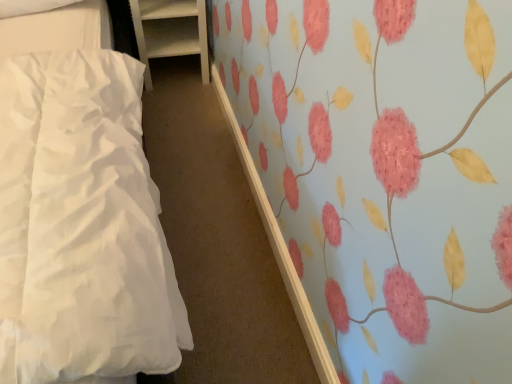
Question: From the image's perspective, is white satin bed at left located above or below white wood shelf at upper left?

Choices:
 (A) below
 (B) above

Answer: (A)

Question: Does point (39, 329) appear closer or farther from the camera than point (148, 56)?

Choices:
 (A) closer
 (B) farther

Answer: (A)

Question: Is white satin bed at left inside the boundaries of white wood shelf at upper left, or outside?

Choices:
 (A) inside
 (B) outside

Answer: (B)

Question: Visually, is white wood shelf at upper left positioned to the left or to the right of white satin bed at left?

Choices:
 (A) left
 (B) right

Answer: (B)

Question: Does point (204, 66) appear closer or farther from the camera than point (112, 79)?

Choices:
 (A) closer
 (B) farther

Answer: (B)

Question: In terms of width, does white wood shelf at upper left look wider or thinner when compared to white satin bed at left?

Choices:
 (A) thin
 (B) wide

Answer: (A)

Question: Looking at the image, does white wood shelf at upper left seem bigger or smaller compared to white satin bed at left?

Choices:
 (A) small
 (B) big

Answer: (B)